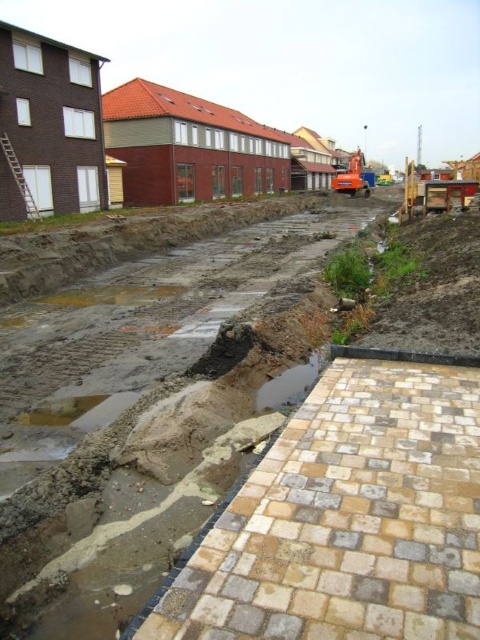
Question: Which of the following is the farthest from the observer?

Choices:
 (A) shiny concrete puddle at lower center
 (B) natural stone paving at lower right

Answer: (A)

Question: Is natural stone paving at lower right thinner than shiny concrete puddle at lower center?

Choices:
 (A) yes
 (B) no

Answer: (B)

Question: Does natural stone paving at lower right come in front of shiny concrete puddle at lower center?

Choices:
 (A) yes
 (B) no

Answer: (A)

Question: Can you confirm if natural stone paving at lower right is positioned to the right of shiny concrete puddle at lower center?

Choices:
 (A) yes
 (B) no

Answer: (A)

Question: Among these objects, which one is farthest from the camera?

Choices:
 (A) natural stone paving at lower right
 (B) shiny concrete puddle at lower center

Answer: (B)

Question: Among these points, which one is farthest from the camera?

Choices:
 (A) (199, 636)
 (B) (285, 378)

Answer: (B)